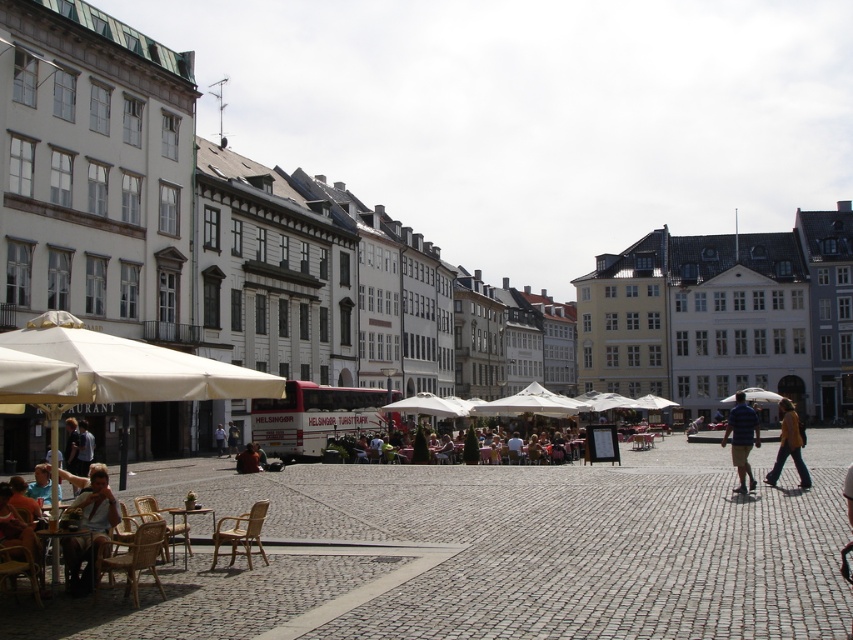
Between wooden table at lower left and wooden table at center, which one appears on the right side from the viewer's perspective?

wooden table at center

What do you see at coordinates (57, 541) in the screenshot?
I see `wooden table at lower left` at bounding box center [57, 541].

Which is in front, point (51, 570) or point (177, 508)?

Point (51, 570) is in front.

Locate an element on the screen. The height and width of the screenshot is (640, 853). wooden table at lower left is located at coordinates (57, 541).

Does wooden table at center have a larger size compared to brown leather jacket at center?

No.

Which is behind, point (186, 524) or point (258, 460)?

The point (258, 460) is behind.

I want to click on wooden table at center, so click(x=184, y=518).

In order to click on wooden table at center in this screenshot , I will do `click(184, 518)`.

Who is shorter, wooden table at lower left or light brown wooden chair at center?

light brown wooden chair at center is shorter.

Based on the photo, can you confirm if wooden table at lower left is thinner than light brown wooden chair at center?

Incorrect, wooden table at lower left's width is not less than light brown wooden chair at center's.

At what (x,y) coordinates should I click in order to perform the action: click on wooden table at lower left. Please return your answer as a coordinate pair (x, y). This screenshot has height=640, width=853. Looking at the image, I should click on (57, 541).